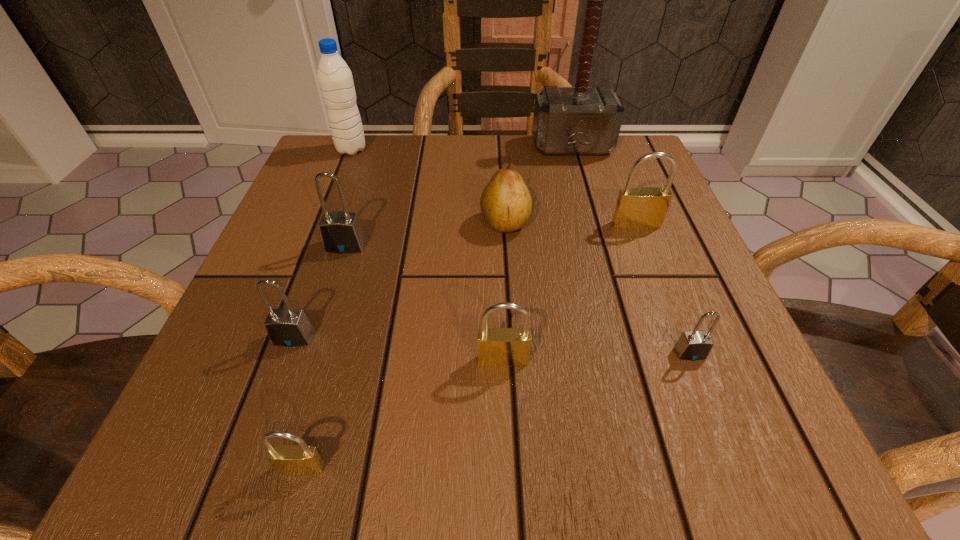
This screenshot has height=540, width=960. In the image, there is a desktop. Identify the location of free space at the far edge. (400, 196).

At what (x,y) coordinates should I click in order to perform the action: click on free space at the near edge of the desktop. Please return your answer as a coordinate pair (x, y). Image resolution: width=960 pixels, height=540 pixels. Looking at the image, I should click on (329, 475).

At what (x,y) coordinates should I click in order to perform the action: click on vacant space at the left edge. Please return your answer as a coordinate pair (x, y). Looking at the image, I should click on (244, 372).

Image resolution: width=960 pixels, height=540 pixels. What are the coordinates of `free space at the right edge` in the screenshot? It's located at (688, 389).

The width and height of the screenshot is (960, 540). I want to click on free space at the far left corner of the desktop, so click(309, 192).

Identify the location of vacant space at the near right corner. (667, 454).

Locate an element on the screen. This screenshot has width=960, height=540. vacant area that lies between the smallest gray padlock and the water bottle is located at coordinates (520, 251).

Where is `free space between the smallest gray padlock and the water bottle`? The width and height of the screenshot is (960, 540). free space between the smallest gray padlock and the water bottle is located at coordinates (520, 251).

Locate an element on the screen. The width and height of the screenshot is (960, 540). free spot between the farthest brass padlock and the second farthest padlock is located at coordinates (491, 235).

Image resolution: width=960 pixels, height=540 pixels. Identify the location of free space between the brown pear and the rightmost gray padlock. (597, 288).